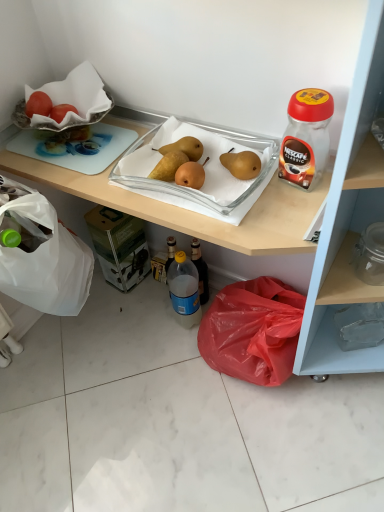
Identify the location of free space to the left of yellow matte pears at center. This screenshot has height=512, width=384. (133, 177).